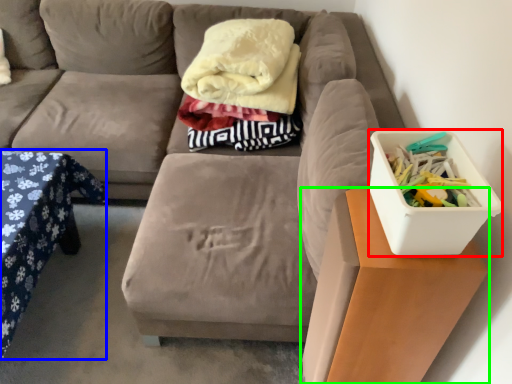
Question: Which is farther away from storage box (highlighted by a red box)? table (highlighted by a blue box) or table (highlighted by a green box)?

Choices:
 (A) table
 (B) table

Answer: (A)